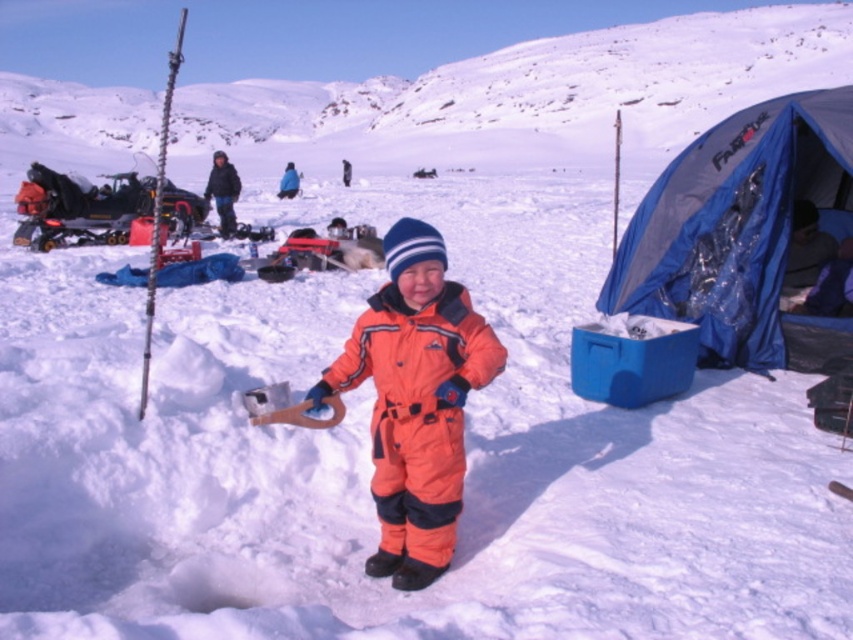
Question: Is blue fabric tent at right smaller than blue woolen hat at upper center?

Choices:
 (A) yes
 (B) no

Answer: (A)

Question: Among these objects, which one is farthest from the camera?

Choices:
 (A) orange softshell snowsuit at center
 (B) blue fabric tent at right

Answer: (B)

Question: Which object is positioned farthest from the dark blue jacket at upper center?

Choices:
 (A) blue fabric tent at right
 (B) blue woolen hat at upper center
 (C) dark blue fabric sleeping bag at right

Answer: (C)

Question: Estimate the real-world distances between objects in this image. Which object is farther from the blue fabric tent at right?

Choices:
 (A) blue woolen hat at upper center
 (B) dark blue fabric sleeping bag at right
 (C) dark blue jacket at upper center
 (D) orange snowsuit at center

Answer: (D)

Question: Is orange softshell snowsuit at center to the right of orange snowsuit at center from the viewer's perspective?

Choices:
 (A) no
 (B) yes

Answer: (B)

Question: Is orange softshell snowsuit at center bigger than blue woolen hat at upper center?

Choices:
 (A) no
 (B) yes

Answer: (A)